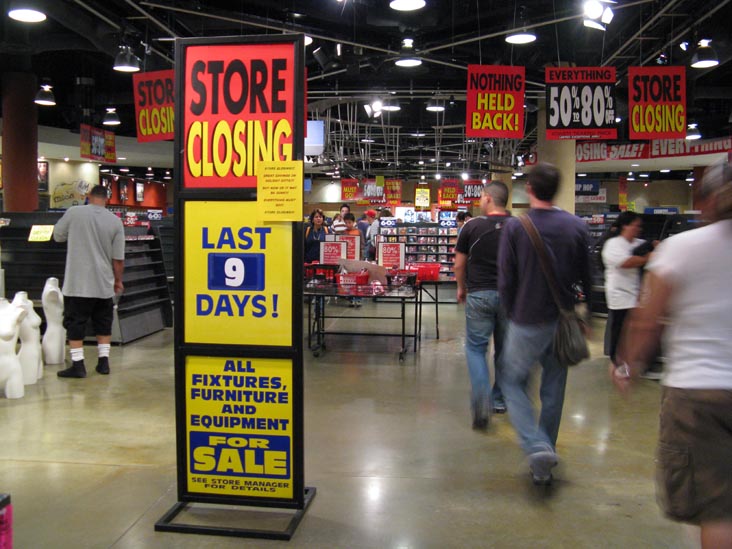
Find the location of `basket`. basket is located at coordinates (353, 277), (320, 263), (427, 268).